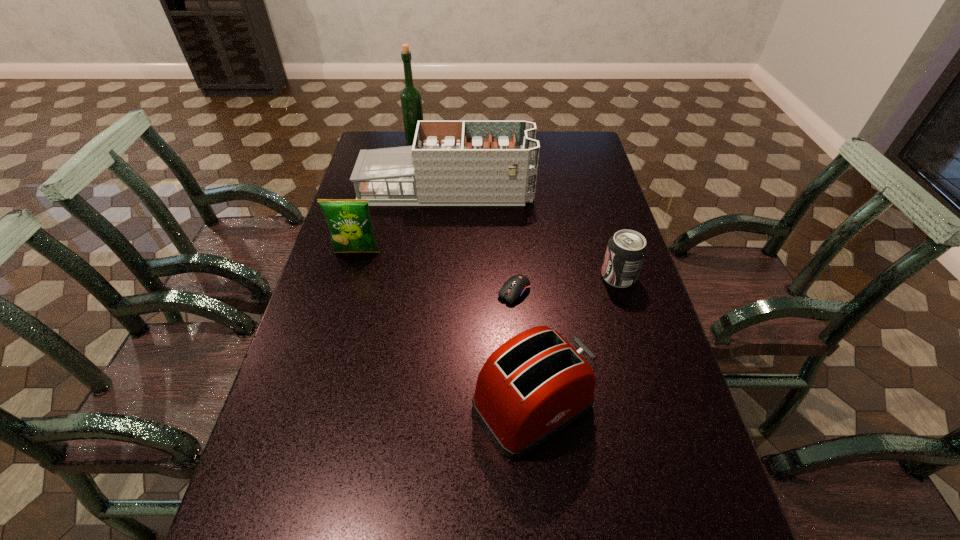
Identify the location of free location located 0.090m on the front-facing side of the crisp (potato chip). (348, 280).

At what (x,y) coordinates should I click in order to perform the action: click on vacant region located 0.120m on the right of the nearest object. Please return your answer as a coordinate pair (x, y). This screenshot has height=540, width=960. Looking at the image, I should click on (647, 406).

Image resolution: width=960 pixels, height=540 pixels. Find the location of `vacant region located 0.300m on the left of the soda can`. vacant region located 0.300m on the left of the soda can is located at coordinates (494, 276).

You are a GUI agent. You are given a task and a screenshot of the screen. Output one action in this format:
    pyautogui.click(x=<x>, y=<y>)
    Task: Click on the vacant space located 0.400m on the front of the computer mouse
    
    Given the screenshot: What is the action you would take?
    pyautogui.click(x=526, y=456)

The image size is (960, 540). Identify the location of object present at the far edge. (411, 102).

Find the location of `liquor that is at the left edge`. liquor that is at the left edge is located at coordinates (411, 102).

You are a GUI agent. You are given a task and a screenshot of the screen. Output one action in this format:
    pyautogui.click(x=<x>, y=<y>)
    Task: Click on the dollhouse situated at the left edge
    
    Given the screenshot: What is the action you would take?
    pyautogui.click(x=452, y=163)

This screenshot has width=960, height=540. Identify the location of crisp (potato chip) that is at the left edge. (351, 229).

The width and height of the screenshot is (960, 540). In order to click on object that is at the right edge in this screenshot , I will do `click(626, 251)`.

This screenshot has height=540, width=960. What are the coordinates of `object at the far left corner` in the screenshot? It's located at pyautogui.click(x=411, y=102).